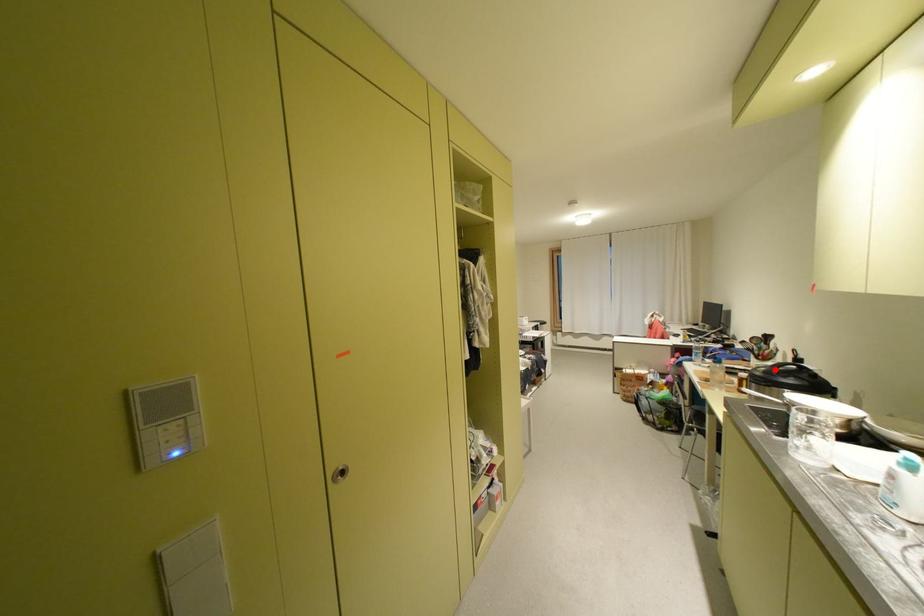
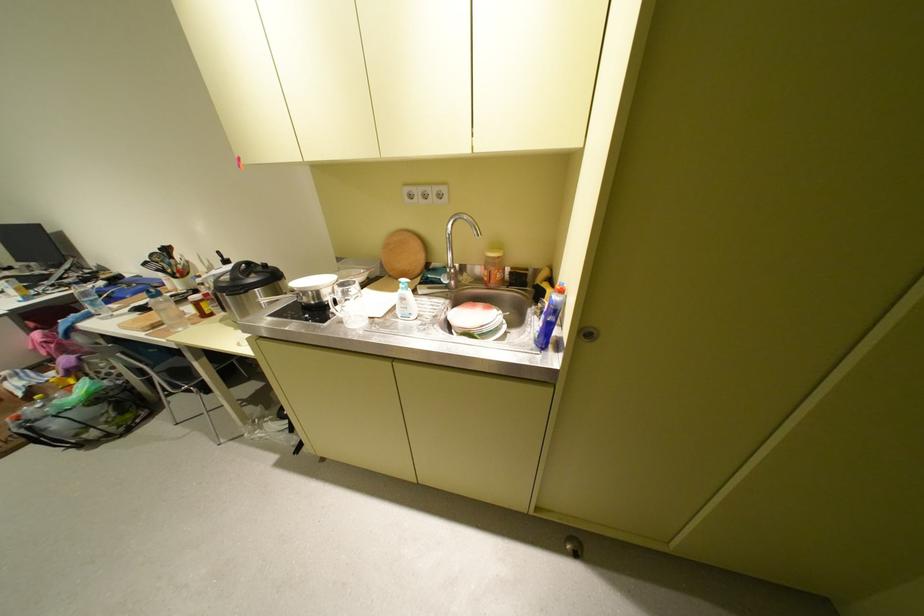
In the second image, find the point that corresponds to the highlighted location in the first image.

(237, 277)